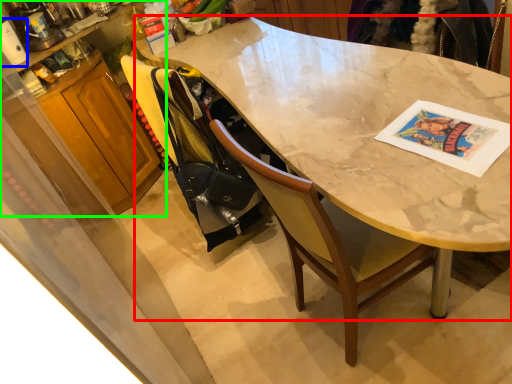
Question: Considering the real-world distances, which object is closest to desk (highlighted by a red box)? appliance (highlighted by a blue box) or cabinetry (highlighted by a green box).

Choices:
 (A) appliance
 (B) cabinetry

Answer: (B)